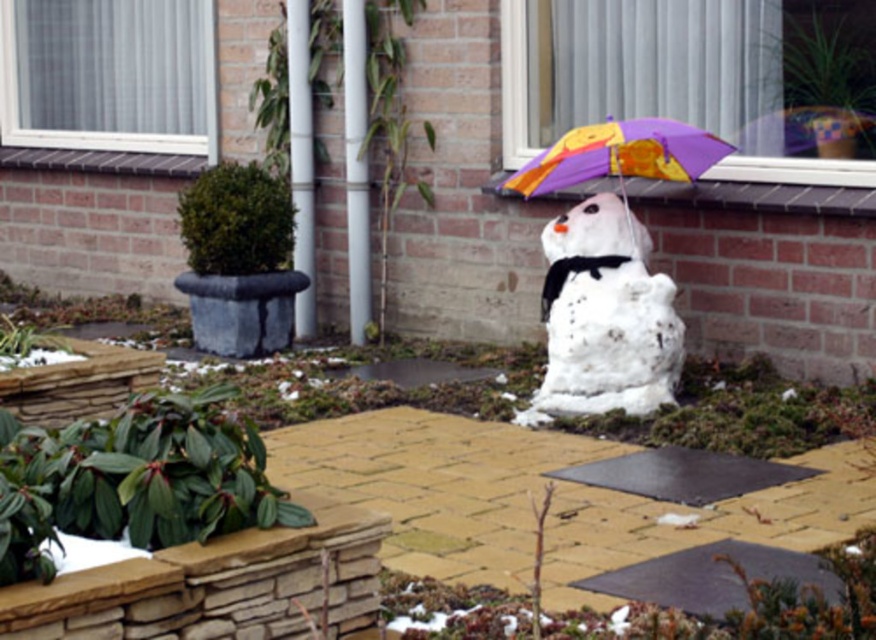
You are standing at the point marked by the coordinate point (604, 316). Looking around the winter scene outside the brick house, what object is located exactly at your current position?

The white fluffy snowman at center is located exactly at the point (604, 316).

You are standing in front of the brick house and see the matte plastic umbrella at center and the purple fabric umbrella at upper center. Which umbrella is closer to the ground?

The matte plastic umbrella at center is closer to the ground because it is located below the purple fabric umbrella at upper center.